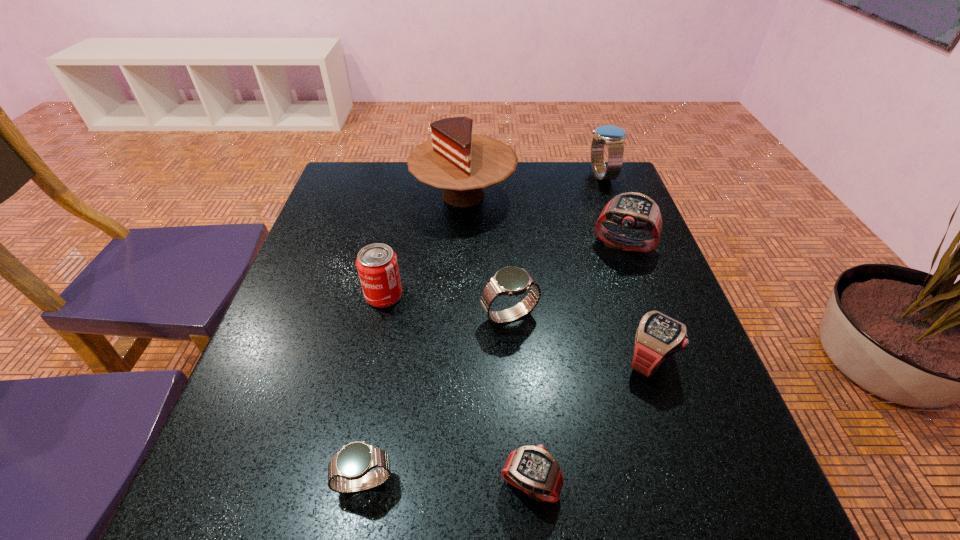
This screenshot has width=960, height=540. I want to click on the second biggest red watch, so click(658, 337).

Identify the location of the leftmost watch. (348, 471).

Image resolution: width=960 pixels, height=540 pixels. Identify the location of the smallest blue watch. (348, 471).

Where is `the leftmost red watch`? The image size is (960, 540). the leftmost red watch is located at coordinates (533, 469).

Where is `the smallest red watch`? The width and height of the screenshot is (960, 540). the smallest red watch is located at coordinates (533, 469).

I want to click on vacant region located on the front of the tallest object, so click(461, 244).

Where is `vacant point located on the left of the farthest watch`? The image size is (960, 540). vacant point located on the left of the farthest watch is located at coordinates (534, 176).

This screenshot has height=540, width=960. I want to click on vacant space located 0.200m on the front of the biggest red watch, so click(x=653, y=325).

In order to click on vacant point located 0.170m on the front of the can in this screenshot , I will do `click(366, 377)`.

Locate an element on the screen. free space located on the back of the second biggest blue watch is located at coordinates (507, 280).